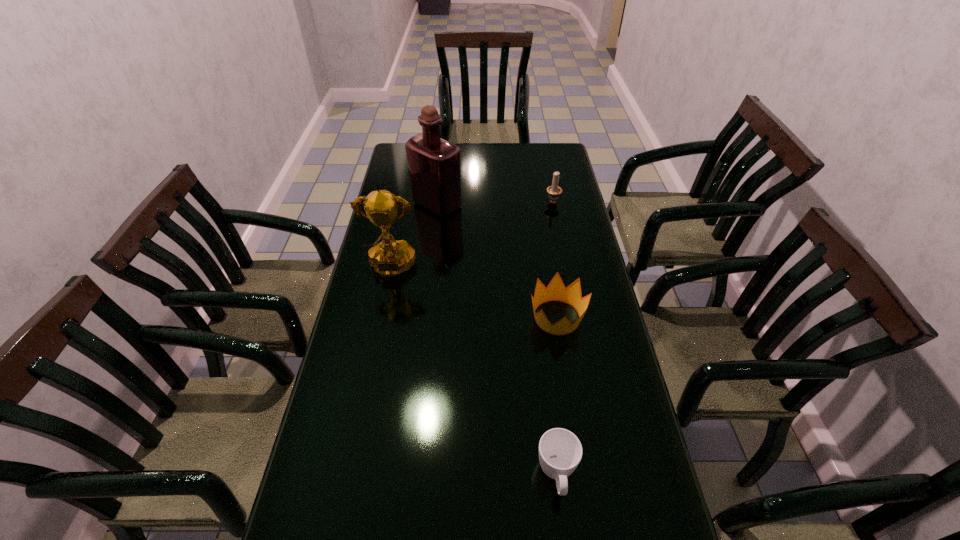
The width and height of the screenshot is (960, 540). Find the location of `the tallest object`. the tallest object is located at coordinates (434, 164).

You are a GUI agent. You are given a task and a screenshot of the screen. Output one action in this format:
    pyautogui.click(x=<x>, y=<y>)
    Task: Click on the third nearest object
    The image size is (960, 540).
    Given the screenshot: What is the action you would take?
    pyautogui.click(x=389, y=258)

The image size is (960, 540). Find the location of `the fourth shortest object`. the fourth shortest object is located at coordinates (389, 258).

Where is `candle_holder`? candle_holder is located at coordinates (554, 191).

The height and width of the screenshot is (540, 960). Find the location of `the fourth farthest object`. the fourth farthest object is located at coordinates (556, 291).

Find the location of a particular element. cup is located at coordinates (560, 451).

Locate an element on the screen. free space located on the right of the tallest object is located at coordinates (503, 205).

Locate an element on the screen. This screenshot has width=960, height=540. free space located 0.200m on the front side of the third nearest object is located at coordinates (376, 340).

Locate an element on the screen. vacant region located 0.160m on the handle side of the candle_holder is located at coordinates (x=547, y=174).

Where is `free spot located 0.380m on the handle side of the candle_holder`? This screenshot has height=540, width=960. free spot located 0.380m on the handle side of the candle_holder is located at coordinates (542, 148).